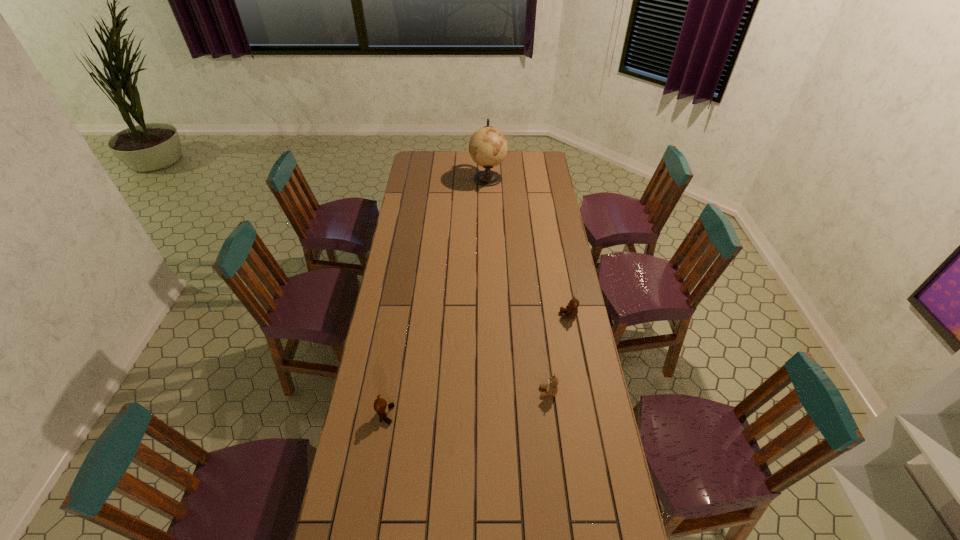
Where is `the farthest object`? the farthest object is located at coordinates 488,147.

You are a GUI agent. You are given a task and a screenshot of the screen. Output one action in this format:
    pyautogui.click(x=<x>, y=<y>)
    Task: Click on the tallest object
    Image resolution: width=960 pixels, height=540 pixels.
    Given the screenshot: What is the action you would take?
    pyautogui.click(x=488, y=147)

Locate an element on the screen. This screenshot has width=960, height=540. the third nearest object is located at coordinates (571, 309).

I want to click on the farthest teddy bear, so click(571, 309).

I want to click on the leftmost object, so click(x=381, y=407).

You are a GUI agent. You are given a task and a screenshot of the screen. Output one action in this format:
    pyautogui.click(x=<x>, y=<y>)
    Task: Click on the nearest teddy bear
    The width and height of the screenshot is (960, 540).
    Given the screenshot: What is the action you would take?
    pyautogui.click(x=381, y=407)

I want to click on the second teddy bear from left to right, so click(x=551, y=388).

Identify the location of the second object from right to left. The image size is (960, 540). (551, 388).

You are a GUI agent. You are given a task and a screenshot of the screen. Output one action in this format:
    pyautogui.click(x=<x>, y=<y>)
    Task: Click on the free spot located on the front-facing side of the third object from right to left
    This screenshot has width=960, height=540.
    Given the screenshot: What is the action you would take?
    pyautogui.click(x=420, y=178)

Find the location of a particular element. This screenshot has height=540, width=960. vacant area located 0.070m on the front-facing side of the third object from right to left is located at coordinates (457, 178).